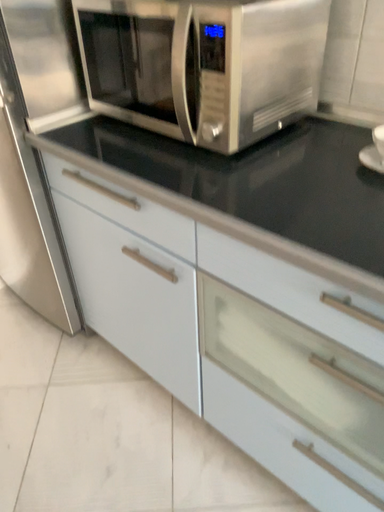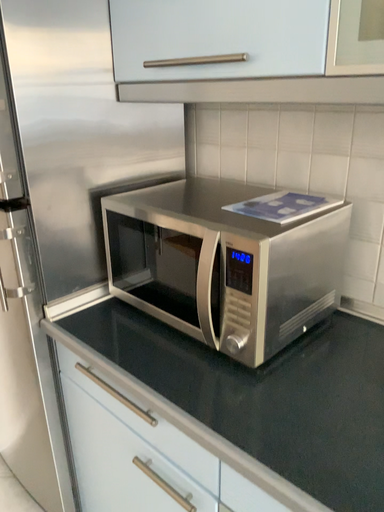
Question: Which way did the camera rotate in the video?

Choices:
 (A) rotated upward
 (B) rotated downward

Answer: (A)